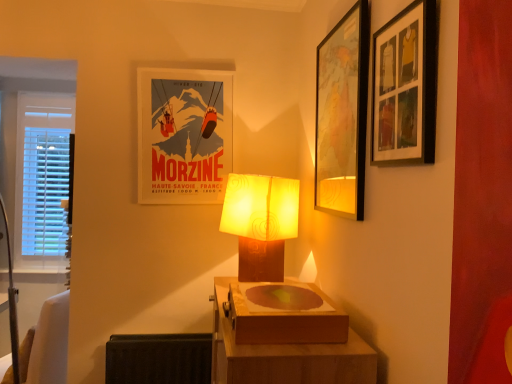
Question: From the image's perspective, is matte brown lamp at center above or below wooden picture frame at upper right, acting as the 3th picture frame starting from the back?

Choices:
 (A) below
 (B) above

Answer: (A)

Question: Would you say matte brown lamp at center is to the left or to the right of wooden picture frame at upper right, acting as the third picture frame starting from the left, in the picture?

Choices:
 (A) right
 (B) left

Answer: (B)

Question: Which is farther from the white fabric swivel chair at lower left?

Choices:
 (A) wooden map at upper right, placed as the second picture frame when sorted from left to right
 (B) wooden picture frame at upper right, which appears as the 1th picture frame when viewed from the right
 (C) wooden table at center
 (D) wooden box at center
 (E) matte paper poster at center, the third picture frame in the front-to-back sequence

Answer: (B)

Question: Which object is positioned farthest from the wooden map at upper right, placed as the second picture frame when sorted from left to right?

Choices:
 (A) wooden table at center
 (B) white fabric swivel chair at lower left
 (C) matte paper poster at center, the third picture frame in the front-to-back sequence
 (D) wooden box at center
 (E) matte brown lamp at center

Answer: (B)